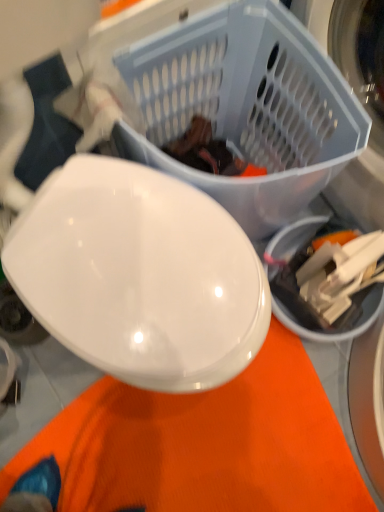
Question: Which is correct: dark brown fabric at center is inside matte plastic laundry basket at upper center, or outside of it?

Choices:
 (A) outside
 (B) inside

Answer: (B)

Question: Is dark brown fabric at center taller or shorter than matte plastic laundry basket at upper center?

Choices:
 (A) tall
 (B) short

Answer: (B)

Question: Based on their sizes in the image, would you say dark brown fabric at center is bigger or smaller than matte plastic laundry basket at upper center?

Choices:
 (A) big
 (B) small

Answer: (B)

Question: Is matte plastic laundry basket at upper center bigger or smaller than dark brown fabric at center?

Choices:
 (A) small
 (B) big

Answer: (B)

Question: Considering their positions, is matte plastic laundry basket at upper center located in front of or behind dark brown fabric at center?

Choices:
 (A) front
 (B) behind

Answer: (A)

Question: In the image, is matte plastic laundry basket at upper center on the left side or the right side of dark brown fabric at center?

Choices:
 (A) right
 (B) left

Answer: (A)

Question: Considering the positions of matte plastic laundry basket at upper center and dark brown fabric at center in the image, is matte plastic laundry basket at upper center wider or thinner than dark brown fabric at center?

Choices:
 (A) thin
 (B) wide

Answer: (B)